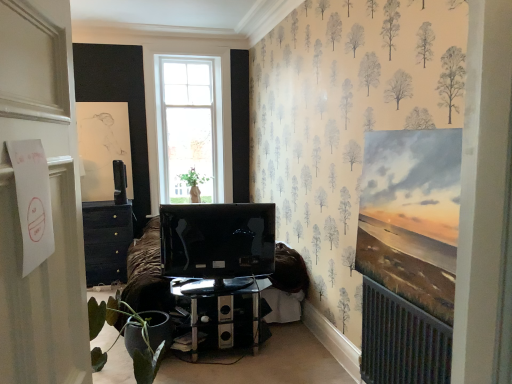
The width and height of the screenshot is (512, 384). Describe the element at coordinates (194, 183) in the screenshot. I see `green matte vase at center` at that location.

Identify the location of transparent glass desk at center. Image resolution: width=512 pixels, height=384 pixels. (221, 314).

This screenshot has width=512, height=384. Describe the element at coordinates (221, 314) in the screenshot. I see `transparent glass desk at center` at that location.

Describe the element at coordinates (51, 197) in the screenshot. This screenshot has height=384, width=512. I see `white matte door at left` at that location.

What do you see at coordinates (126, 337) in the screenshot? The image size is (512, 384). I see `green matte plant at lower left` at bounding box center [126, 337].

Locate an element on the screen. Image resolution: width=512 pixels, height=384 pixels. green matte vase at center is located at coordinates (194, 183).

Could you tell me if transparent glass desk at center is turned towards white matte door at left?

No, transparent glass desk at center does not turn towards white matte door at left.

From the image's perspective, is transparent glass desk at center on top of white matte door at left?

No, from the image's perspective, transparent glass desk at center is not over white matte door at left.

The image size is (512, 384). I want to click on desk that appears on the right of white matte door at left, so pos(221,314).

In terms of height, does transparent glass desk at center look taller or shorter compared to white matte door at left?

In the image, transparent glass desk at center appears to be shorter than white matte door at left.

Is white matte door at left far from matte black tv at center, which ranks as the 2th television in left-to-right order?

Yes.

Which is more distant, (5, 268) or (241, 236)?

The point (241, 236) is farther.

Looking at this image, from the image's perspective, is white matte door at left positioned above or below matte black tv at center, which ranks as the 2th television in left-to-right order?

Clearly, from the image's perspective, white matte door at left is above matte black tv at center, which ranks as the 2th television in left-to-right order.

From a real-world perspective, does green matte vase at center sit lower than green matte plant at lower left?

Incorrect, from a real-world perspective, green matte vase at center is higher than green matte plant at lower left.

Considering the positions of points (193, 188) and (133, 362), is point (193, 188) closer to camera compared to point (133, 362)?

No, it is behind (133, 362).

Is green matte vase at center oriented towards green matte plant at lower left?

Yes, green matte vase at center is turned towards green matte plant at lower left.

Is point (27, 61) in front of point (181, 314)?

Yes.

Is white matte door at left positioned before transparent glass desk at center?

Yes, white matte door at left is in front of transparent glass desk at center.

Is white matte door at left oriented away from transparent glass desk at center?

white matte door at left does not have its back to transparent glass desk at center.

In the scene shown: Would you say white matte door at left is inside or outside transparent glass desk at center?

white matte door at left is located beyond the bounds of transparent glass desk at center.

Identify the location of houseplant on the right of satin black television at upper left, arranged as the 2th television when viewed from the right. (126, 337).

Are green matte plant at lower left and satin black television at upper left, which appears as the second television when ordered from the bottom, far apart?

Yes, green matte plant at lower left and satin black television at upper left, which appears as the second television when ordered from the bottom, are quite far apart.

Is green matte plant at lower left looking in the opposite direction of satin black television at upper left, the 1th television from the top?

Yes.

In the scene shown: From their relative heights in the image, would you say matte black tv at center, arranged as the 2th television when viewed from the top, is taller or shorter than transparent glass desk at center?

Clearly, matte black tv at center, arranged as the 2th television when viewed from the top, is taller compared to transparent glass desk at center.

Is the depth of matte black tv at center, which ranks as the 2th television in left-to-right order, less than that of transparent glass desk at center?

Yes, it is.

The width and height of the screenshot is (512, 384). I want to click on the 1st television directly above the transparent glass desk at center (from a real-world perspective), so click(217, 242).

How different are the orientations of matte black tv at center, the 1th television positioned from the right, and transparent glass desk at center in degrees?

matte black tv at center, the 1th television positioned from the right, and transparent glass desk at center are facing 170 degrees away from each other.

Relative to transparent glass desk at center, is green matte plant at lower left in front or behind?

green matte plant at lower left is in front of transparent glass desk at center.

How different are the orientations of green matte plant at lower left and transparent glass desk at center in degrees?

The facing directions of green matte plant at lower left and transparent glass desk at center are 1.32e-05 degrees apart.

Is transparent glass desk at center at the back of green matte plant at lower left?

green matte plant at lower left does not have its back to transparent glass desk at center.

Would you say green matte plant at lower left is a long distance from transparent glass desk at center?

green matte plant at lower left is near transparent glass desk at center, not far away.

Where is `door on the left side of transparent glass desk at center`? This screenshot has height=384, width=512. door on the left side of transparent glass desk at center is located at coordinates (51, 197).

Find the location of `television below the white matte door at left (from the image's perspective)`. television below the white matte door at left (from the image's perspective) is located at coordinates tap(217, 242).

Estimate the real-world distances between objects in this image. Which object is further from green matte vase at center, green matte plant at lower left or transparent glass desk at center?

Based on the image, green matte plant at lower left appears to be further to green matte vase at center.

Based on their spatial positions, is transparent glass desk at center or green matte vase at center closer to green matte plant at lower left?

Based on the image, transparent glass desk at center appears to be nearer to green matte plant at lower left.

Looking at the image, which one is located further to transparent glass desk at center, satin black television at upper left, the 1th television from the top, or green matte vase at center?

Among the two, green matte vase at center is located further to transparent glass desk at center.

Considering their positions, is matte black tv at center, arranged as the first television when ordered from the bottom, positioned further to white matte door at left than green matte vase at center?

green matte vase at center is positioned further to the anchor white matte door at left.

Looking at the image, which one is located further to white matte door at left, matte black tv at center, arranged as the 2th television when viewed from the top, or green matte plant at lower left?

matte black tv at center, arranged as the 2th television when viewed from the top, is further to white matte door at left.

Looking at the image, which one is located closer to green matte plant at lower left, satin black television at upper left, arranged as the 2th television when viewed from the right, or matte black tv at center, arranged as the 2th television when viewed from the top?

matte black tv at center, arranged as the 2th television when viewed from the top.

Considering their positions, is matte black tv at center, the 2th television from the back, positioned further to satin black television at upper left, marked as the 2th television in a front-to-back arrangement, than green matte vase at center?

matte black tv at center, the 2th television from the back, is further to satin black television at upper left, marked as the 2th television in a front-to-back arrangement.

From the picture: Looking at the image, which one is located closer to green matte vase at center, satin black television at upper left, which is counted as the first television, starting from the left, or matte black tv at center, which ranks as the 2th television in left-to-right order?

Among the two, satin black television at upper left, which is counted as the first television, starting from the left, is located nearer to green matte vase at center.

Where is `houseplant between white matte door at left and matte black tv at center, arranged as the first television when ordered from the bottom, in the front-back direction`? The height and width of the screenshot is (384, 512). houseplant between white matte door at left and matte black tv at center, arranged as the first television when ordered from the bottom, in the front-back direction is located at coordinates (126, 337).

Find the location of a particular element. The height and width of the screenshot is (384, 512). television situated between green matte plant at lower left and transparent glass desk at center from left to right is located at coordinates (217, 242).

Find the location of a particular element. The image size is (512, 384). houseplant between white matte door at left and green matte vase at center along the z-axis is located at coordinates click(x=126, y=337).

I want to click on houseplant between white matte door at left and satin black television at upper left, arranged as the 2th television when viewed from the right, in the front-back direction, so click(126, 337).